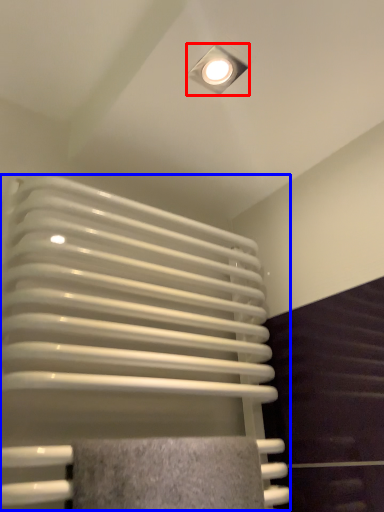
Question: Which point is further to the camera, lamp (highlighted by a red box) or radiator (highlighted by a blue box)?

Choices:
 (A) lamp
 (B) radiator

Answer: (A)